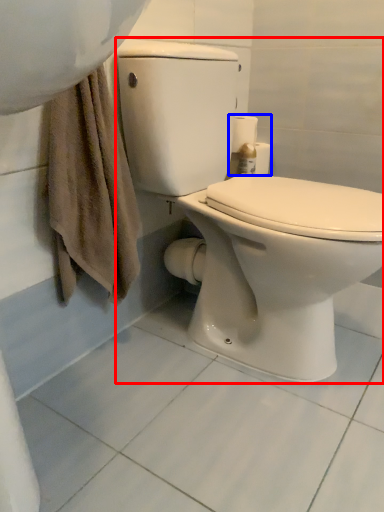
Question: Which point is closer to the camera, toilet (highlighted by a red box) or toilet paper (highlighted by a blue box)?

Choices:
 (A) toilet
 (B) toilet paper

Answer: (A)